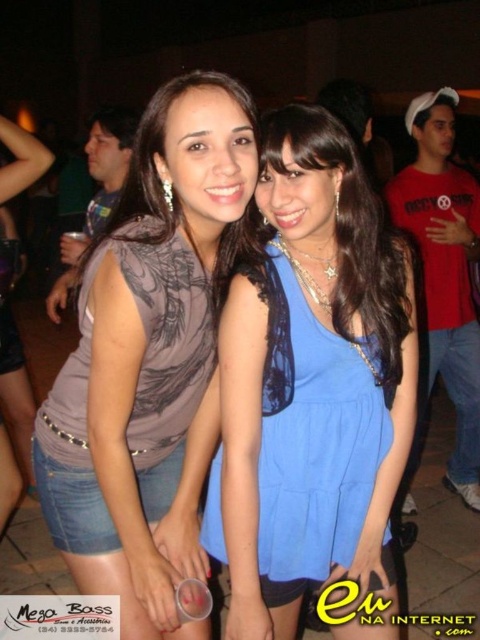
You are a photographer at a party and want to ensure both the matte gray tank top at center and the blue lace dress at center are fully visible in your photo. Given their heights, which one might require you to adjust your camera angle to capture its full length?

The blue lace dress at center is taller than the matte gray tank top at center, so you might need to adjust your camera angle to capture its full length.

You are at a party and want to wear the same style of top as the woman in the image. The store has both the matte gray shirt at center and the matte gray tank top at center. If you prefer a looser fit, which one should you choose?

The matte gray shirt at center has a larger width than the matte gray tank top at center, so it would provide a looser fit.

In the scene shown: You are at a party and want to take a photo of the matte gray shirt at center and the blue lace dress at center. Which one is on the left side when facing the two people?

The matte gray shirt at center is positioned on the left side of the blue lace dress at center, so the matte gray shirt at center is on the left when facing the two people.